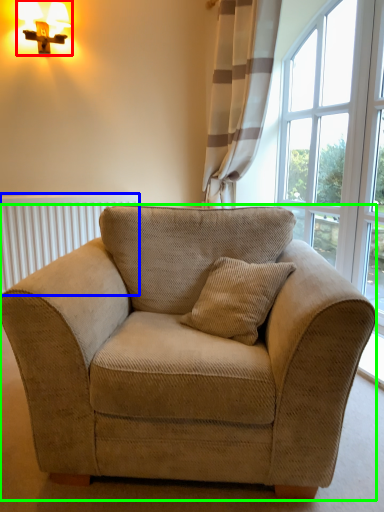
Question: Which is nearer to the table lamp (highlighted by a red box)? radiator (highlighted by a blue box) or studio couch (highlighted by a green box).

Choices:
 (A) radiator
 (B) studio couch

Answer: (A)